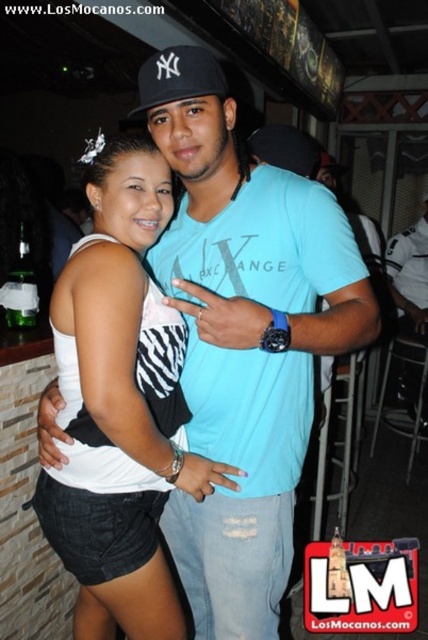
Question: Is white denim shorts at center behind black fabric baseball cap at upper center?

Choices:
 (A) yes
 (B) no

Answer: (B)

Question: Where is white denim shorts at center located in relation to black fabric baseball cap at upper center in the image?

Choices:
 (A) right
 (B) left

Answer: (B)

Question: Is white denim shorts at center to the left of black fabric baseball cap at upper center from the viewer's perspective?

Choices:
 (A) yes
 (B) no

Answer: (A)

Question: Which of the following is the farthest from the observer?

Choices:
 (A) white denim shorts at center
 (B) black fabric baseball cap at upper center

Answer: (B)